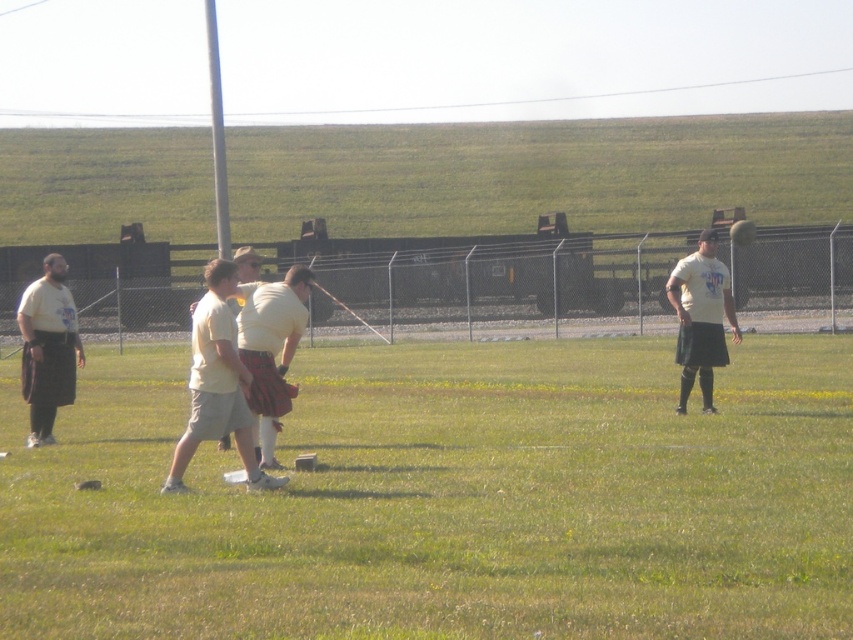
Is matte white t-shirt at right bigger than light yellow shirt at center?

No.

Is matte white t-shirt at right smaller than light yellow shirt at center?

Yes, matte white t-shirt at right is smaller than light yellow shirt at center.

Is point (677, 284) closer to viewer compared to point (239, 275)?

No, it is behind (239, 275).

I want to click on matte white t-shirt at right, so click(x=701, y=317).

Is point (196, 403) closer to viewer compared to point (300, 284)?

Yes, point (196, 403) is in front of point (300, 284).

Is light beige cotton t-shirt at center positioned at the back of plaid fabric kilt at center?

No, light beige cotton t-shirt at center is in front of plaid fabric kilt at center.

Measure the distance between point (213, 353) and camera.

The distance of point (213, 353) from camera is 36.47 feet.

Locate an element on the screen. This screenshot has width=853, height=640. light beige cotton t-shirt at center is located at coordinates (218, 381).

Which is behind, point (199, 316) or point (78, 362)?

The point (78, 362) is more distant.

Between light beige cotton t-shirt at center and matte black kilt at left, which one has more height?

Standing taller between the two is matte black kilt at left.

Describe the element at coordinates (218, 381) in the screenshot. The image size is (853, 640). I see `light beige cotton t-shirt at center` at that location.

Find the location of a particular element. The image size is (853, 640). light beige cotton t-shirt at center is located at coordinates (218, 381).